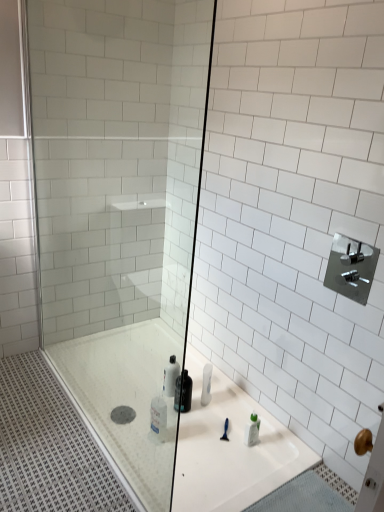
Question: Does transparent glass shower door at center have a greater height compared to satin nickel faucet at upper right?

Choices:
 (A) yes
 (B) no

Answer: (A)

Question: Would you say transparent glass shower door at center is outside satin nickel faucet at upper right?

Choices:
 (A) no
 (B) yes

Answer: (B)

Question: Is satin nickel faucet at upper right at the back of transparent glass shower door at center?

Choices:
 (A) no
 (B) yes

Answer: (A)

Question: From the image's perspective, is transparent glass shower door at center over satin nickel faucet at upper right?

Choices:
 (A) no
 (B) yes

Answer: (B)

Question: From the image's perspective, would you say transparent glass shower door at center is shown under satin nickel faucet at upper right?

Choices:
 (A) no
 (B) yes

Answer: (A)

Question: Is translucent plastic bottle at center in front of or behind transparent glass shower door at center in the image?

Choices:
 (A) behind
 (B) front

Answer: (A)

Question: Considering the relative positions of translucent plastic bottle at center and transparent glass shower door at center in the image provided, is translucent plastic bottle at center to the left or to the right of transparent glass shower door at center?

Choices:
 (A) left
 (B) right

Answer: (B)

Question: Is translucent plastic bottle at center bigger or smaller than transparent glass shower door at center?

Choices:
 (A) small
 (B) big

Answer: (A)

Question: Is point (175, 398) positioned closer to the camera than point (122, 119)?

Choices:
 (A) farther
 (B) closer

Answer: (B)

Question: From a real-world perspective, is transparent glass shower door at center positioned above or below satin nickel faucet at upper right?

Choices:
 (A) below
 (B) above

Answer: (A)

Question: Relative to satin nickel faucet at upper right, is transparent glass shower door at center in front or behind?

Choices:
 (A) behind
 (B) front

Answer: (B)

Question: Is transparent glass shower door at center taller or shorter than satin nickel faucet at upper right?

Choices:
 (A) tall
 (B) short

Answer: (A)

Question: Considering the positions of point (155, 479) and point (352, 251), is point (155, 479) closer or farther from the camera than point (352, 251)?

Choices:
 (A) closer
 (B) farther

Answer: (B)

Question: From a real-world perspective, is satin nickel faucet at upper right above or below translucent plastic bottle at center?

Choices:
 (A) above
 (B) below

Answer: (A)

Question: Visually, is satin nickel faucet at upper right positioned to the left or to the right of translucent plastic bottle at center?

Choices:
 (A) right
 (B) left

Answer: (A)